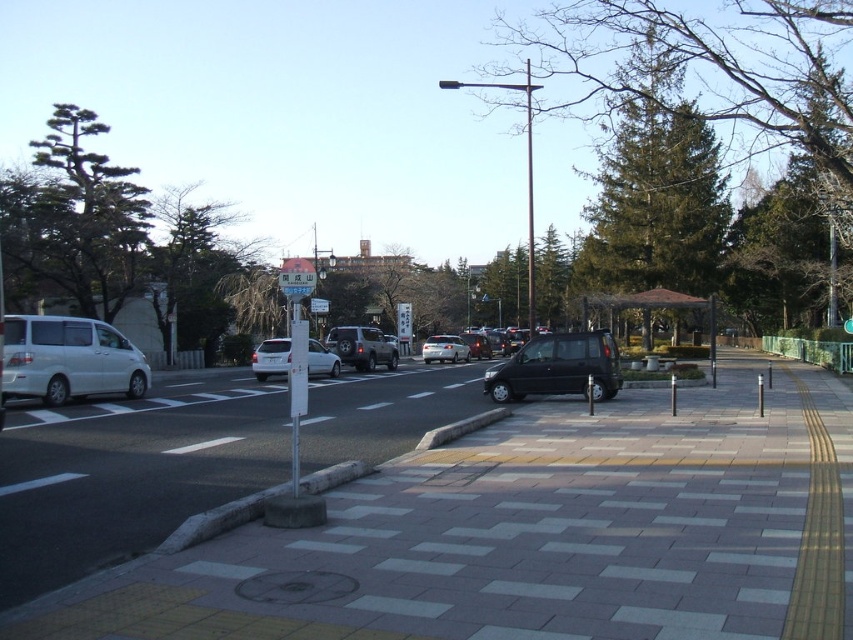
Between point (534, 342) and point (291, 285), which one is positioned behind?

Positioned behind is point (534, 342).

Is shiny black van at center smaller than metallic street sign at center?

Yes, shiny black van at center is smaller than metallic street sign at center.

Who is more distant from viewer, (582, 368) or (305, 259)?

The point (305, 259) is more distant.

Find the location of a particular element. shiny black van at center is located at coordinates (556, 368).

Consider the image. Between green textured tree at center and metallic street sign at center, which one appears on the right side from the viewer's perspective?

green textured tree at center is more to the right.

This screenshot has width=853, height=640. Find the location of `green textured tree at center`. green textured tree at center is located at coordinates (705, 68).

Is point (805, 134) closer to camera compared to point (300, 288)?

No, it is not.

The image size is (853, 640). I want to click on green textured tree at center, so click(x=705, y=68).

Between green textured tree at center and green textured tree at upper right, which one is positioned higher?

green textured tree at center is above.

What are the coordinates of `green textured tree at center` in the screenshot? It's located at (705, 68).

In order to click on green textured tree at center in this screenshot , I will do `click(705, 68)`.